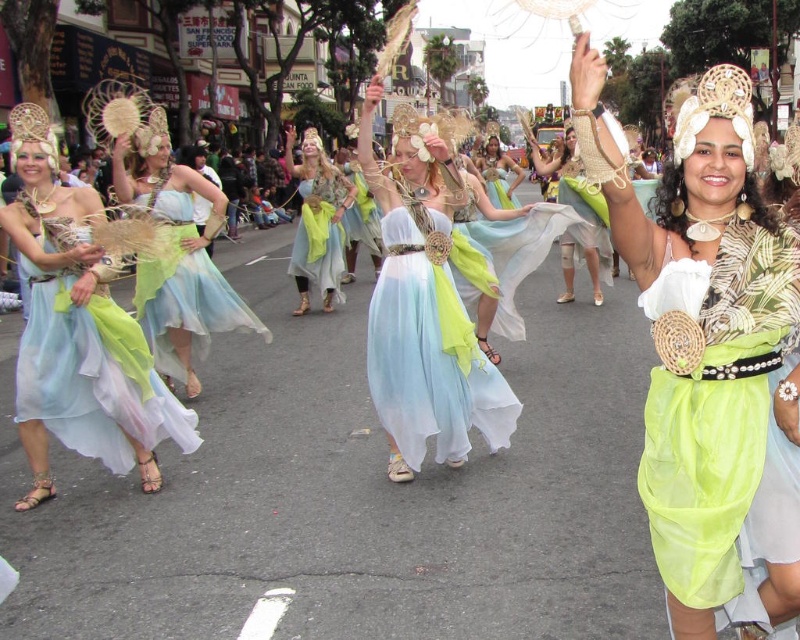
Question: Based on their relative distances, which object is farther from the matte straw hat at center?

Choices:
 (A) translucent fabric dress at center
 (B) linen-like green dress at center
 (C) lime green sheer fabric dress at center
 (D) matte blue fabric dress at center

Answer: (C)

Question: Can you confirm if matte blue fabric dress at center is positioned to the right of matte straw hat at center?

Choices:
 (A) yes
 (B) no

Answer: (B)

Question: Which object is closer to the camera taking this photo?

Choices:
 (A) lime green fabric skirt at center
 (B) translucent fabric dress at center
 (C) matte straw hat at center

Answer: (A)

Question: Is pastel chiffon dress at center positioned at the back of linen-like green dress at center?

Choices:
 (A) yes
 (B) no

Answer: (B)

Question: Which point appears closest to the camera in this image?

Choices:
 (A) (318, 234)
 (B) (404, 266)
 (C) (778, 548)
 (D) (704, 412)

Answer: (C)

Question: Observing the image, what is the correct spatial positioning of lime green fabric skirt at center in reference to matte blue fabric dress at left?

Choices:
 (A) left
 (B) right

Answer: (B)